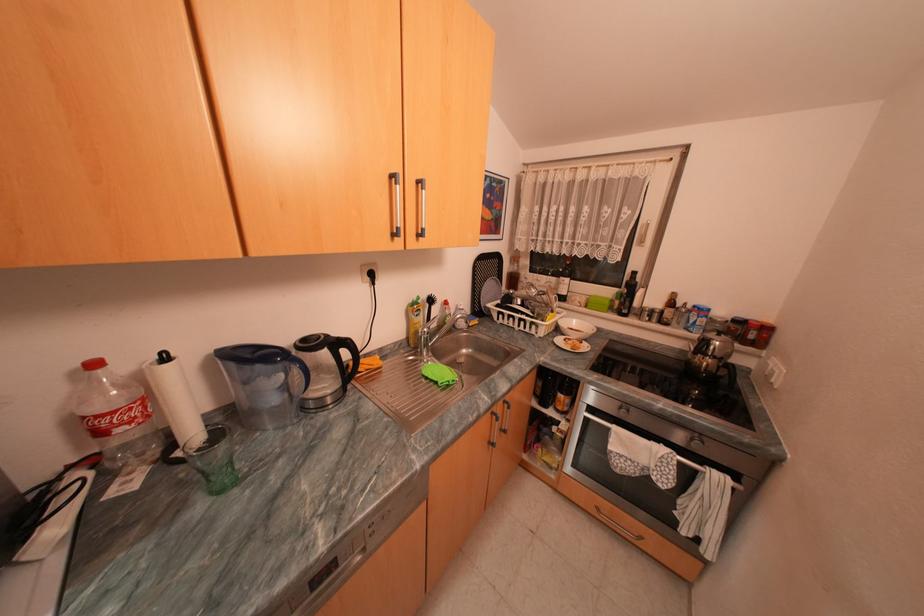
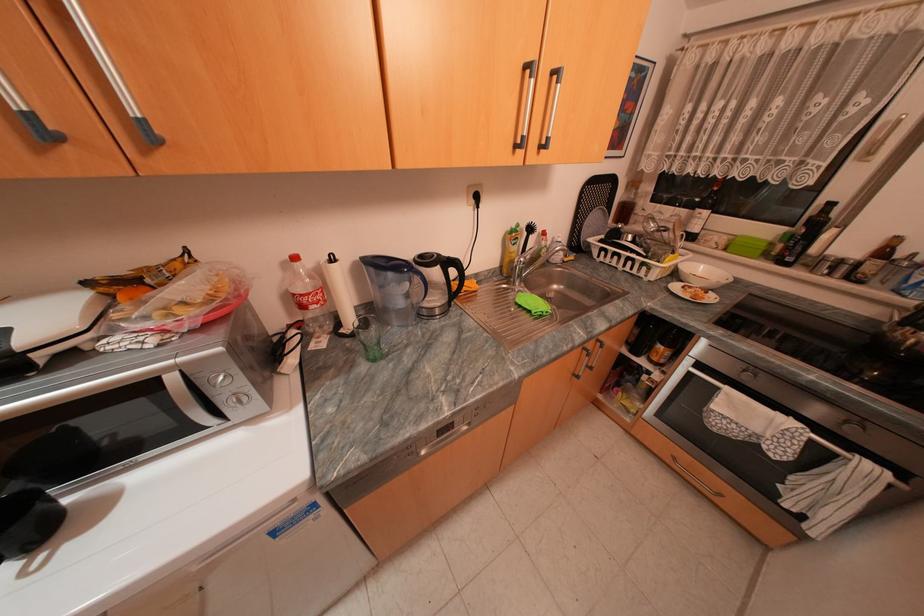
Based on the continuous images, in which direction is the camera rotating?

The camera rotated toward left-down.